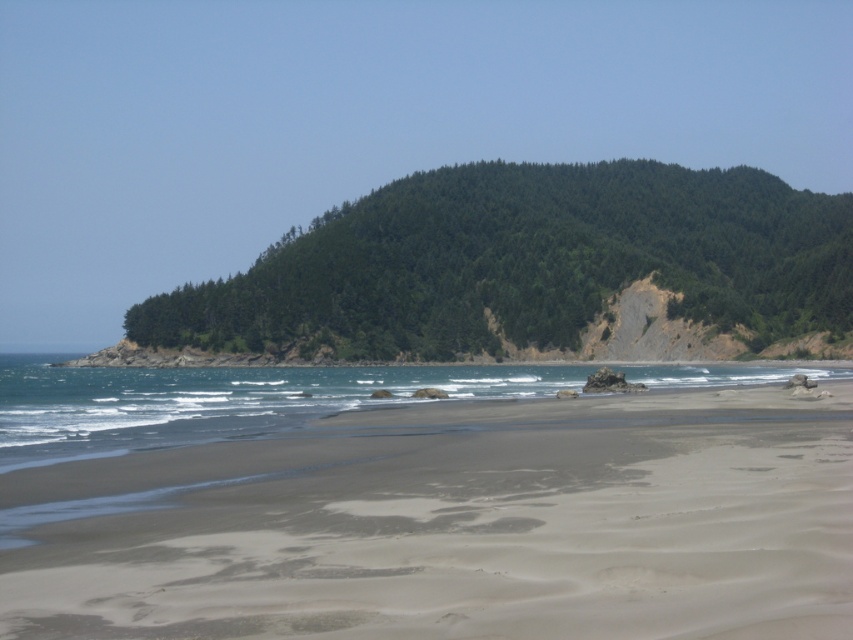
Question: Among these objects, which one is farthest from the camera?

Choices:
 (A) clear blue water at lower center
 (B) sandy beach at lower center

Answer: (A)

Question: Does sandy beach at lower center come in front of clear blue water at lower center?

Choices:
 (A) no
 (B) yes

Answer: (B)

Question: Is sandy beach at lower center behind clear blue water at lower center?

Choices:
 (A) yes
 (B) no

Answer: (B)

Question: Can you confirm if sandy beach at lower center is positioned above clear blue water at lower center?

Choices:
 (A) no
 (B) yes

Answer: (B)

Question: Among these objects, which one is farthest from the camera?

Choices:
 (A) sandy beach at lower center
 (B) clear blue water at lower center

Answer: (B)

Question: Which point appears closest to the camera in this image?

Choices:
 (A) (468, 474)
 (B) (3, 371)

Answer: (A)